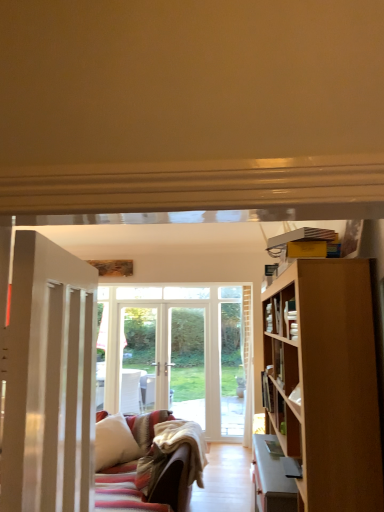
Locate an element on the screen. This screenshot has width=384, height=512. wooden bookshelf at right is located at coordinates (280, 312).

Locate an element on the screen. This screenshot has width=384, height=512. hardcover book at right is located at coordinates (267, 392).

Image resolution: width=384 pixels, height=512 pixels. Describe the element at coordinates (267, 392) in the screenshot. I see `hardcover book at right` at that location.

Find the location of a particular element. Image resolution: width=384 pixels, height=512 pixels. white soft pillow at lower left is located at coordinates (114, 442).

Which of these two, white soft pillow at lower left or wooden bookshelf at right, is smaller?

Smaller between the two is wooden bookshelf at right.

How far apart are white soft pillow at lower left and wooden bookshelf at right?

white soft pillow at lower left is 7.13 feet away from wooden bookshelf at right.

The height and width of the screenshot is (512, 384). I want to click on shelf above the white soft pillow at lower left (from the image's perspective), so pyautogui.click(x=280, y=312).

Which object is more forward, white soft pillow at lower left or wooden bookshelf at right?

wooden bookshelf at right is more forward.

Is hardcover book at right placed right next to white soft pillow at lower left?

hardcover book at right is not next to white soft pillow at lower left, and they're not touching.

The width and height of the screenshot is (384, 512). In order to click on book in front of the white soft pillow at lower left in this screenshot , I will do [x=267, y=392].

Can you confirm if hardcover book at right is shorter than white soft pillow at lower left?

Indeed, hardcover book at right has a lesser height compared to white soft pillow at lower left.

Is white painted wood door at left spatially inside wooden bookshelf at right, or outside of it?

white painted wood door at left exists outside the volume of wooden bookshelf at right.

Is white painted wood door at left aimed at wooden bookshelf at right?

No, white painted wood door at left does not turn towards wooden bookshelf at right.

The image size is (384, 512). In order to click on door below the wooden bookshelf at right (from the image's perspective) in this screenshot , I will do `click(49, 380)`.

From a real-world perspective, is white painted wood door at left above or below wooden bookshelf at right?

From a real-world perspective, white painted wood door at left is physically below wooden bookshelf at right.

Which is behind, point (115, 451) or point (48, 312)?

The point (115, 451) is farther.

Choose the correct answer: Is white soft pillow at lower left inside white painted wood door at left or outside it?

white soft pillow at lower left is not enclosed by white painted wood door at left.

Which of these two, white soft pillow at lower left or white painted wood door at left, is smaller?

With smaller size is white painted wood door at left.

In the scene shown: Is the depth of white soft pillow at lower left less than that of white painted wood door at left?

No, white soft pillow at lower left is further to the viewer.

Is hardcover book at right beside white painted wood door at left?

hardcover book at right and white painted wood door at left are clearly separated.

Is hardcover book at right further to camera compared to white painted wood door at left?

Yes, hardcover book at right is further from the viewer.

Does hardcover book at right have a lesser width compared to white painted wood door at left?

Yes.

From the image's perspective, which is below, hardcover book at right or white painted wood door at left?

hardcover book at right is shown below in the image.

From the image's perspective, relative to wooden bookshelf at right, is hardcover book at right above or below?

hardcover book at right is situated lower than wooden bookshelf at right in the image.

Considering the relative sizes of hardcover book at right and wooden bookshelf at right in the image provided, is hardcover book at right smaller than wooden bookshelf at right?

Yes.

Is hardcover book at right positioned with its back to wooden bookshelf at right?

No, hardcover book at right's orientation is not away from wooden bookshelf at right.

How distant is hardcover book at right from wooden bookshelf at right?

hardcover book at right and wooden bookshelf at right are 15.61 inches apart from each other.

Is white soft pillow at lower left to the left or to the right of hardcover book at right in the image?

Based on their positions, white soft pillow at lower left is located to the left of hardcover book at right.

Which object is further away from the camera taking this photo, white soft pillow at lower left or hardcover book at right?

white soft pillow at lower left is further away from the camera.

Does white soft pillow at lower left have a smaller size compared to hardcover book at right?

No, white soft pillow at lower left is not smaller than hardcover book at right.

From a real-world perspective, which is physically below, white soft pillow at lower left or hardcover book at right?

white soft pillow at lower left.

At what (x,y) coordinates should I click in order to perform the action: click on pillow behind the wooden bookshelf at right. Please return your answer as a coordinate pair (x, y). This screenshot has height=512, width=384. Looking at the image, I should click on (114, 442).

I want to click on pillow below the hardcover book at right (from the image's perspective), so click(114, 442).

When comparing their distances from wooden bookshelf at right, does hardcover book at right or white soft pillow at lower left seem closer?

hardcover book at right lies closer to wooden bookshelf at right than the other object.

Estimate the real-world distances between objects in this image. Which object is closer to white soft pillow at lower left, white painted wood door at left or hardcover book at right?

hardcover book at right.

Estimate the real-world distances between objects in this image. Which object is further from white soft pillow at lower left, hardcover book at right or white painted wood door at left?

white painted wood door at left lies further to white soft pillow at lower left than the other object.

Estimate the real-world distances between objects in this image. Which object is closer to hardcover book at right, white painted wood door at left or wooden bookshelf at right?

The object closer to hardcover book at right is wooden bookshelf at right.

Estimate the real-world distances between objects in this image. Which object is closer to wooden bookshelf at right, white soft pillow at lower left or hardcover book at right?

The object closer to wooden bookshelf at right is hardcover book at right.

Considering their positions, is hardcover book at right positioned closer to white painted wood door at left than wooden bookshelf at right?

wooden bookshelf at right is closer to white painted wood door at left.

Looking at the image, which one is located closer to hardcover book at right, wooden bookshelf at right or white painted wood door at left?

wooden bookshelf at right.

Looking at this image, which object lies nearer to the anchor point hardcover book at right, white soft pillow at lower left or white painted wood door at left?

white painted wood door at left.

You are a GUI agent. You are given a task and a screenshot of the screen. Output one action in this format:
    pyautogui.click(x=<x>, y=<y>)
    Task: Click on the shelf located between white painted wood door at left and white soft pillow at lower left in the depth direction
    
    Given the screenshot: What is the action you would take?
    pyautogui.click(x=280, y=312)

The width and height of the screenshot is (384, 512). I want to click on shelf between white painted wood door at left and hardcover book at right from front to back, so click(280, 312).

Image resolution: width=384 pixels, height=512 pixels. Find the location of `book between white soft pillow at lower left and wooden bookshelf at right in the horizontal direction`. book between white soft pillow at lower left and wooden bookshelf at right in the horizontal direction is located at coordinates (267, 392).

This screenshot has width=384, height=512. I want to click on book between white painted wood door at left and white soft pillow at lower left along the z-axis, so click(x=267, y=392).